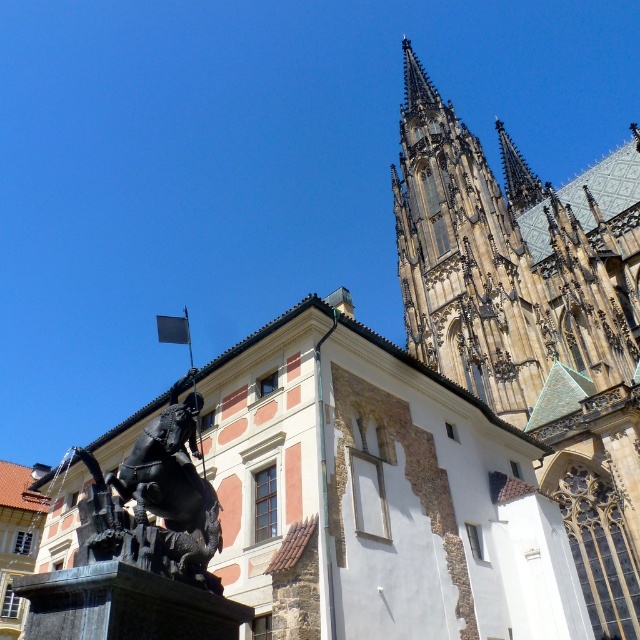
Question: Which point is closer to the camera taking this photo?

Choices:
 (A) coord(464,326)
 (B) coord(467,260)

Answer: (A)

Question: Observing the image, what is the correct spatial positioning of golden stone spire at upper center in reference to polished bronze statue at center?

Choices:
 (A) below
 (B) above

Answer: (B)

Question: Is golden stone tower at upper center bigger than polished bronze statue at center?

Choices:
 (A) no
 (B) yes

Answer: (B)

Question: Does golden stone spire at upper center appear on the right side of polished bronze statue at center?

Choices:
 (A) no
 (B) yes

Answer: (B)

Question: Which of the following is the closest to the observer?

Choices:
 (A) polished bronze statue at center
 (B) golden stone tower at upper center

Answer: (A)

Question: Estimate the real-world distances between objects in this image. Which object is closer to the golden stone spire at upper center?

Choices:
 (A) golden stone tower at upper center
 (B) polished bronze statue at center

Answer: (A)